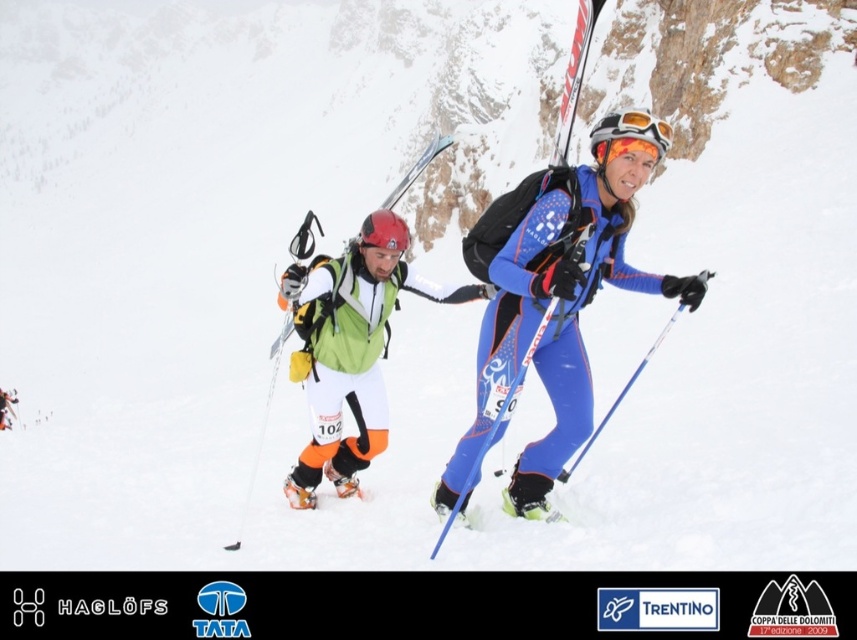
Question: Is blue/orange ski suit at center below matte green ski at center-left?

Choices:
 (A) no
 (B) yes

Answer: (B)

Question: Does green fabric jacket at center appear on the right side of orange reflective goggles at center?

Choices:
 (A) yes
 (B) no

Answer: (B)

Question: Is green fabric jacket at center to the right of matte green ski at center-left from the viewer's perspective?

Choices:
 (A) no
 (B) yes

Answer: (B)

Question: Which object is farther from the camera taking this photo?

Choices:
 (A) matte green ski at center-left
 (B) blue/orange ski suit at center
 (C) orange reflective goggles at center
 (D) green fabric jacket at center

Answer: (D)

Question: Estimate the real-world distances between objects in this image. Which object is closer to the green fabric jacket at center?

Choices:
 (A) blue/orange ski suit at center
 (B) matte green ski at center-left
 (C) orange reflective goggles at center

Answer: (B)

Question: Which point is farther to the camera?

Choices:
 (A) (469, 289)
 (B) (454, 496)
 (C) (309, 289)

Answer: (A)